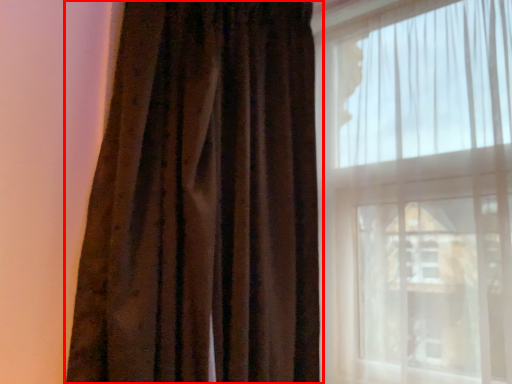
Question: From the image's perspective, considering the relative positions of curtain (annotated by the red box) and window in the image provided, where is curtain (annotated by the red box) located with respect to the staircase?

Choices:
 (A) below
 (B) above

Answer: (B)